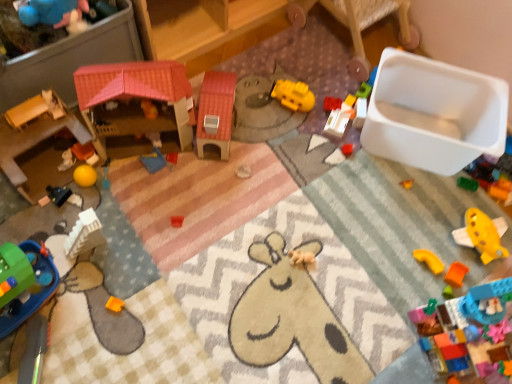
At what (x,y) coordinates should I click in order to perform the action: click on vacant space in front of yellow matte plastic toy at center, which is the 8th toy from right to left. Please return your answer as a coordinate pair (x, y). Looking at the image, I should click on (289, 140).